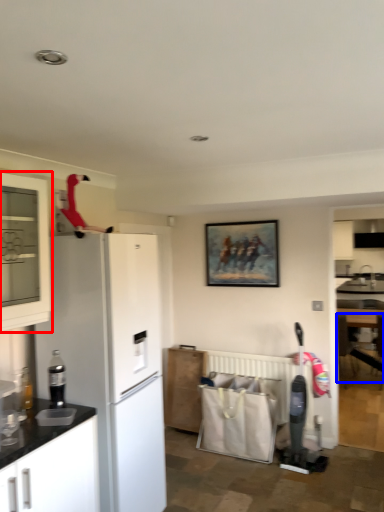
Question: Which object appears farthest to the camera in this image, cabinetry (highlighted by a red box) or armchair (highlighted by a blue box)?

Choices:
 (A) cabinetry
 (B) armchair

Answer: (B)